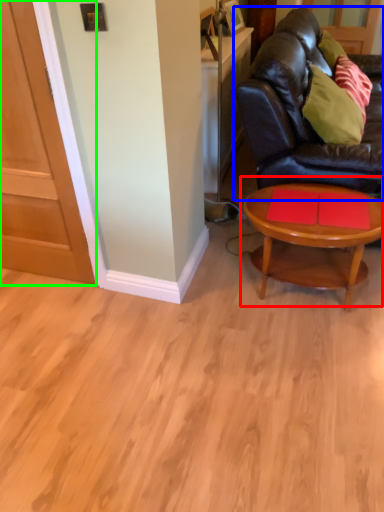
Question: Which object is positioned farthest from coffee table (highlighted by a red box)? Select from studio couch (highlighted by a blue box) and door (highlighted by a green box).

Choices:
 (A) studio couch
 (B) door

Answer: (B)